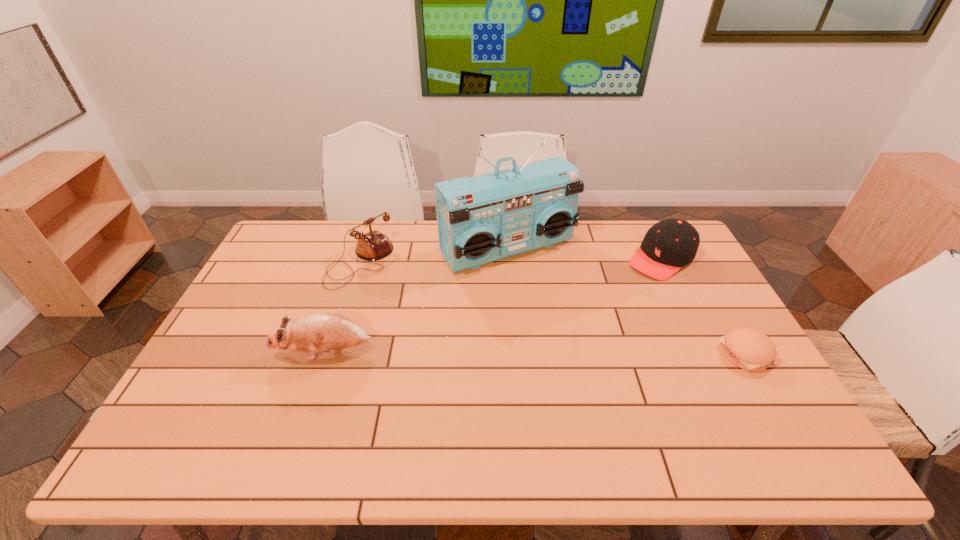
At what (x,y) coordinates should I click in order to perform the action: click on cap situated at the far edge. Please return your answer as a coordinate pair (x, y). Looking at the image, I should click on (670, 244).

I want to click on patty present at the right edge, so click(747, 348).

Locate an element on the screen. This screenshot has width=960, height=540. cap that is at the right edge is located at coordinates (670, 244).

Where is `object present at the far right corner`? This screenshot has height=540, width=960. object present at the far right corner is located at coordinates click(x=670, y=244).

The height and width of the screenshot is (540, 960). In the image, there is a desktop. What are the coordinates of `free space at the far edge` in the screenshot? It's located at tap(319, 248).

At what (x,y) coordinates should I click in order to perform the action: click on free space at the near edge of the desktop. Please return your answer as a coordinate pair (x, y). Looking at the image, I should click on (642, 417).

Identify the location of free space at the left edge. This screenshot has width=960, height=540. (197, 375).

In the image, there is a desktop. Where is `vacant area at the right edge`? vacant area at the right edge is located at coordinates (709, 316).

In the image, there is a desktop. Where is `vacant region at the near left corner`? The width and height of the screenshot is (960, 540). vacant region at the near left corner is located at coordinates coord(208,393).

Locate an element on the screen. Image resolution: width=960 pixels, height=540 pixels. vacant area that lies between the radio receiver and the shortest object is located at coordinates (627, 301).